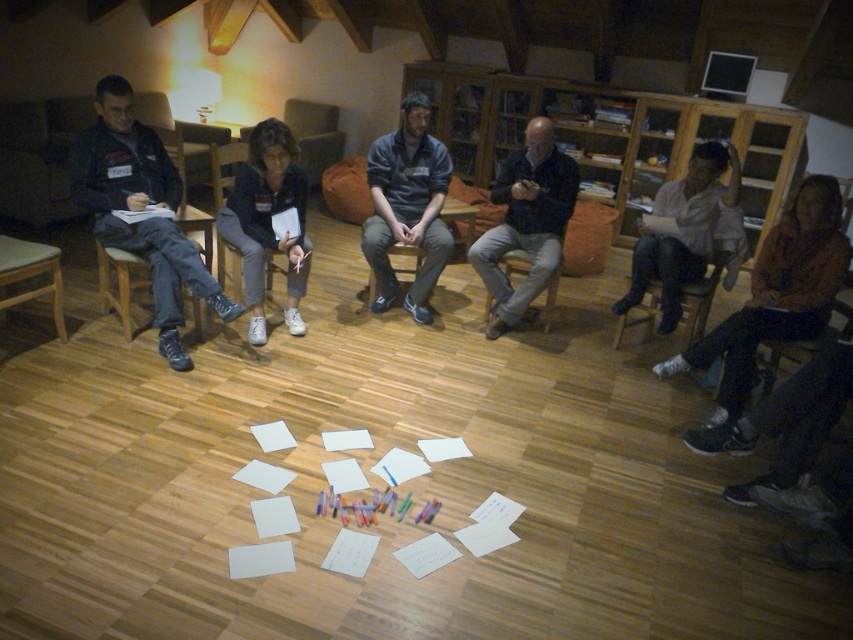
You are standing in the room and want to reach the point marked at coordinates (779, 333). Can you walk directly to it without moving any furniture?

The point marked at coordinates (779, 333) is 10.17 feet away from the viewer, so yes, you can walk directly to it without needing to move any furniture since the distance is sufficient for unobstructed movement.

You are organizing a group activity and need to ensure everyone has enough space. The dark blue sweater at center and wooden at center are both in the middle of the seating area. Which object takes up more horizontal space?

The dark blue sweater at center takes up more horizontal space because its width is larger than the wooden at center.

In the scene shown: You are part of the group seated in the semi circle and you need to pass a pen to the person wearing the dark blue sweater at center. Since you are sitting to the left of the wooden at center, which direction should you pass the pen to reach them?

The dark blue sweater at center is to the right of the wooden at center. Since you are sitting to the left of the wooden at center, passing the pen to your right would reach the dark blue sweater at center.